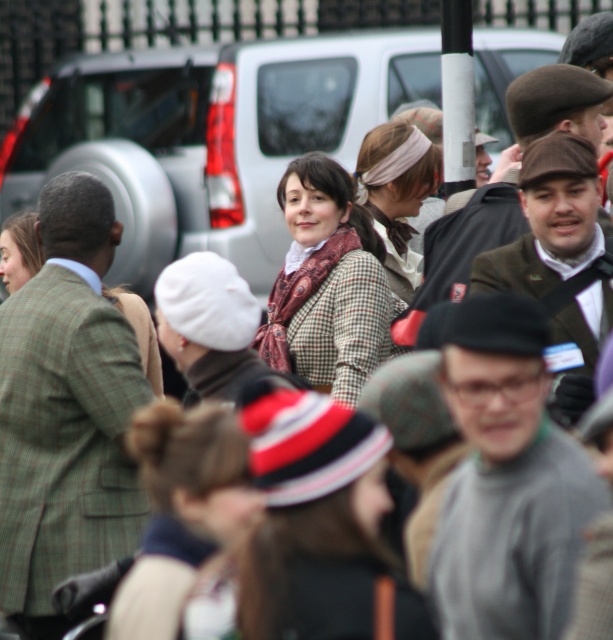
Is gray wool sweater at center positioned at the back of plaid wool coat at center?

No, gray wool sweater at center is in front of plaid wool coat at center.

Locate an element on the screen. gray wool sweater at center is located at coordinates (506, 481).

This screenshot has height=640, width=613. Find the location of `gray wool sweater at center`. gray wool sweater at center is located at coordinates (506, 481).

Can you confirm if green plaid suit at left is wider than matte brown scarf at center?

Yes.

Looking at this image, which is more to the left, green plaid suit at left or matte brown scarf at center?

green plaid suit at left is more to the left.

Image resolution: width=613 pixels, height=640 pixels. Describe the element at coordinates (66, 410) in the screenshot. I see `green plaid suit at left` at that location.

Find the location of a particular element. This screenshot has height=640, width=613. green plaid suit at left is located at coordinates (66, 410).

Does gray wool sweater at center appear on the left side of matte brown scarf at center?

In fact, gray wool sweater at center is to the right of matte brown scarf at center.

Is point (495, 292) closer to camera compared to point (419, 145)?

Yes, it is in front of point (419, 145).

Who is more distant from viewer, (459,404) or (394,282)?

Point (394,282)

Image resolution: width=613 pixels, height=640 pixels. Identify the location of gray wool sweater at center. click(x=506, y=481).